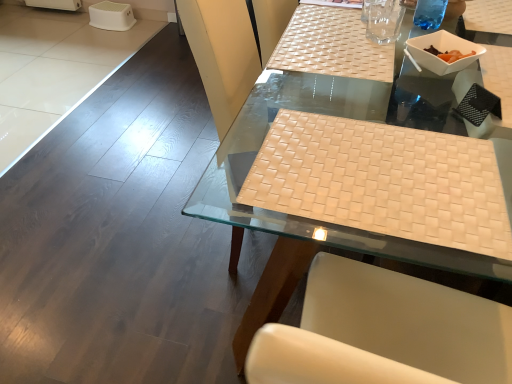
This screenshot has height=384, width=512. I want to click on vacant area that lies to the right of white plastic bowl at upper right, so click(x=496, y=67).